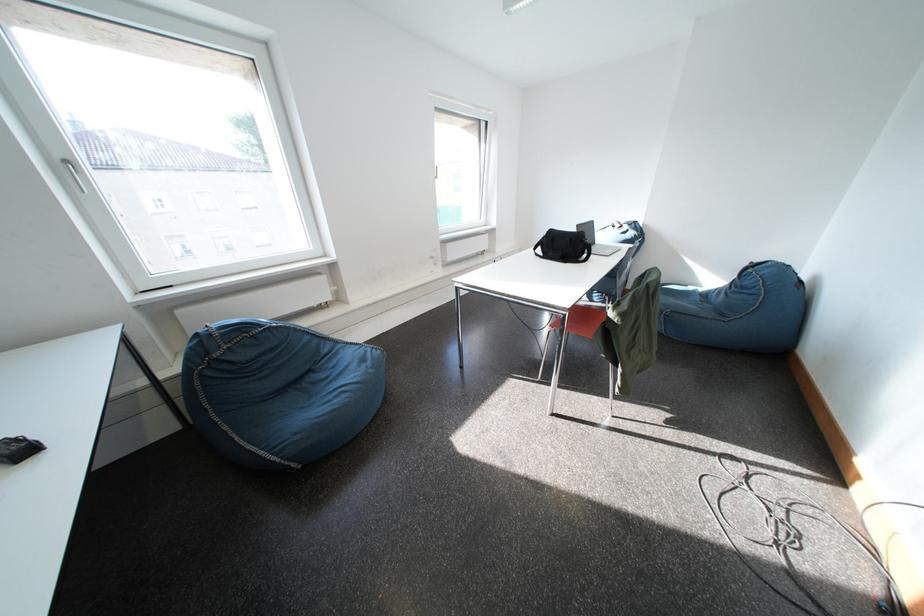
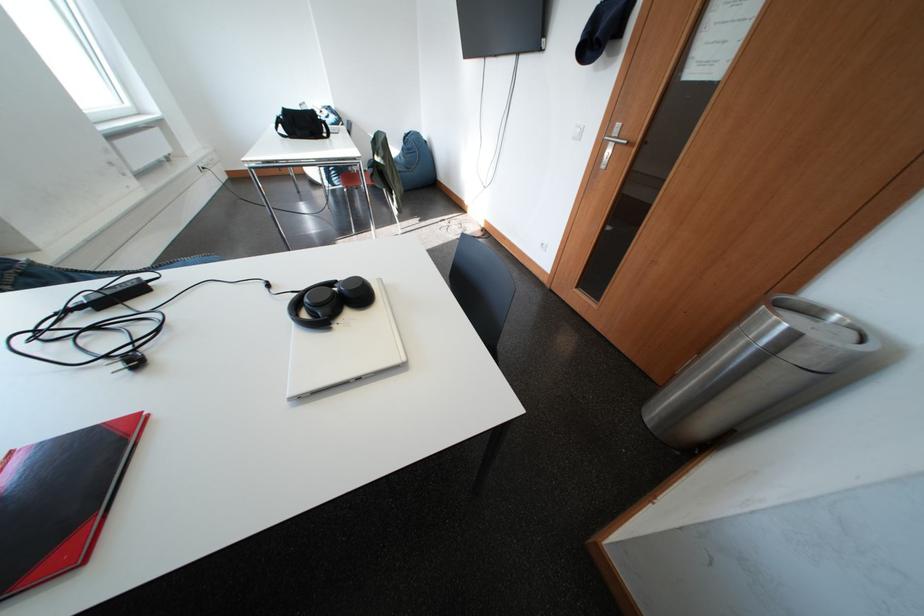
Where in the second image is the point corresponding to pixel 563 235 from the first image?

(297, 114)